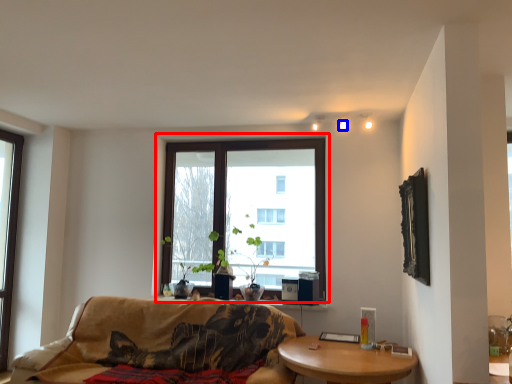
Question: Which point is closer to the camera, window (highlighted by a red box) or light (highlighted by a blue box)?

Choices:
 (A) window
 (B) light

Answer: (B)